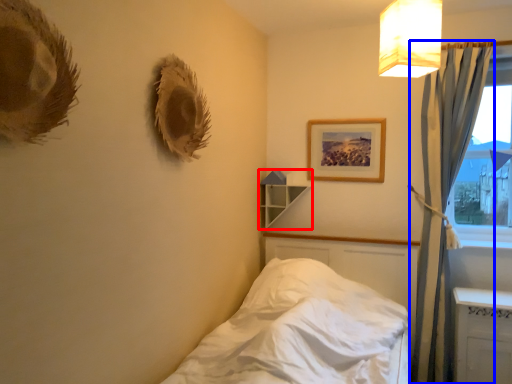
Question: Which of the following is the farthest to the observer, shelf (highlighted by a red box) or curtain (highlighted by a blue box)?

Choices:
 (A) shelf
 (B) curtain

Answer: (A)